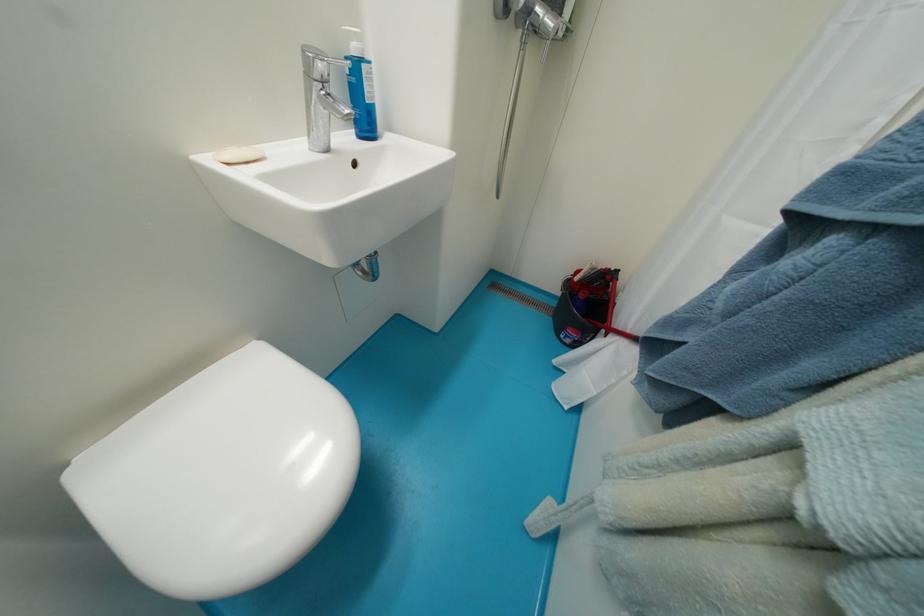
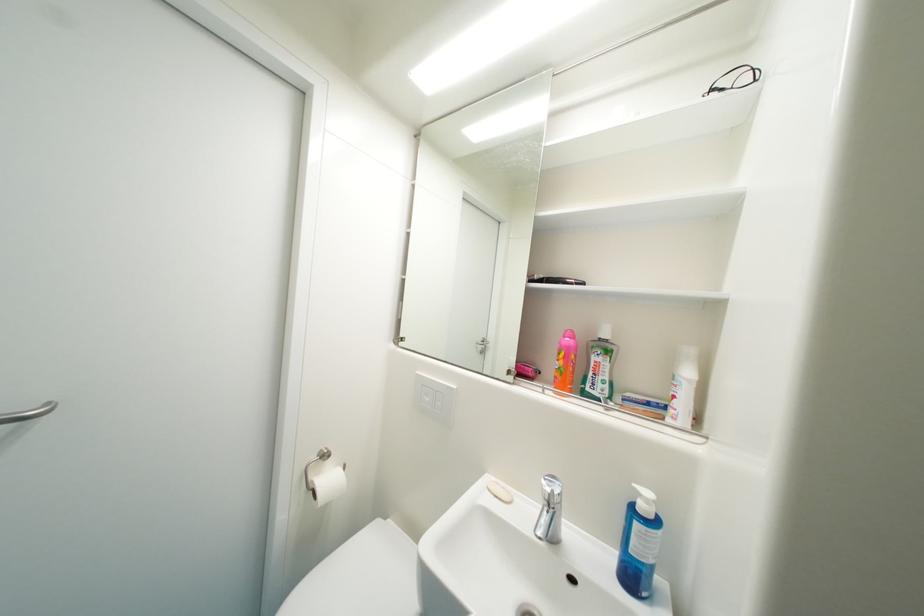
Question: The images are taken continuously from a first-person perspective. In which direction is your viewpoint rotating?

Choices:
 (A) Left
 (B) Right
 (C) Up
 (D) Down

Answer: (A)